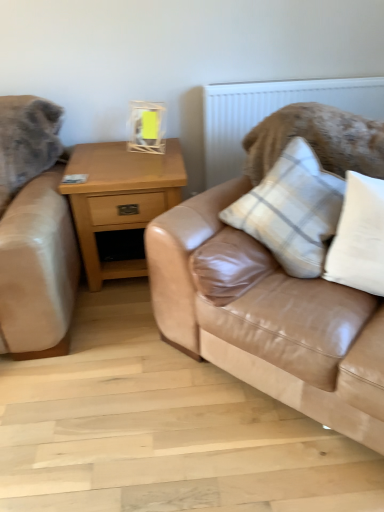
This screenshot has width=384, height=512. Find the location of `matte yellow glass at upper center`. matte yellow glass at upper center is located at coordinates (146, 127).

The width and height of the screenshot is (384, 512). Describe the element at coordinates (273, 112) in the screenshot. I see `white textured radiator at upper center` at that location.

Find the location of a particular element. Image resolution: width=384 pixels, height=512 pixels. white textured radiator at upper center is located at coordinates 273,112.

What do you see at coordinates (359, 237) in the screenshot?
I see `white cotton pillow at upper right, which is the 1th pillow from right to left` at bounding box center [359, 237].

I want to click on light brown wood nightstand at center, so click(x=120, y=198).

In order to face light brown wood nightstand at center, should I rotate leftwards or rightwards?

Turn left by 7.682 degrees to look at light brown wood nightstand at center.

Find the location of a particular element. The height and width of the screenshot is (512, 384). matte yellow glass at upper center is located at coordinates point(146,127).

From the image's perspective, does plaid fabric pillow at center, which is counted as the 1th pillow, starting from the left, appear higher than tan leather couch at center?

Indeed, from the image's perspective, plaid fabric pillow at center, which is counted as the 1th pillow, starting from the left, is shown above tan leather couch at center.

Is plaid fabric pillow at center, arranged as the second pillow when viewed from the right, positioned with its back to tan leather couch at center?

Yes, tan leather couch at center is at the back of plaid fabric pillow at center, arranged as the second pillow when viewed from the right.

What's the angular difference between plaid fabric pillow at center, which is counted as the 1th pillow, starting from the left, and tan leather couch at center's facing directions?

The angle between the facing direction of plaid fabric pillow at center, which is counted as the 1th pillow, starting from the left, and the facing direction of tan leather couch at center is 5.54 degrees.

Which pillow is the 2nd one when counting from the back of the tan leather couch at center? Please provide its 2D coordinates.

[(292, 210)]

Does tan leather couch at center appear on the right side of plaid fabric pillow at center, arranged as the second pillow when viewed from the right?

Correct, you'll find tan leather couch at center to the right of plaid fabric pillow at center, arranged as the second pillow when viewed from the right.

Does point (327, 297) lie in front of point (289, 144)?

That is True.

In the image, is tan leather couch at center positioned in front of or behind plaid fabric pillow at center, which is counted as the 1th pillow, starting from the left?

tan leather couch at center is positioned closer to the viewer than plaid fabric pillow at center, which is counted as the 1th pillow, starting from the left.

Does plaid fabric pillow at center, which is counted as the 1th pillow, starting from the left, turn towards light brown wood nightstand at center?

No, plaid fabric pillow at center, which is counted as the 1th pillow, starting from the left, is not aimed at light brown wood nightstand at center.

Who is smaller, plaid fabric pillow at center, which is counted as the 1th pillow, starting from the left, or light brown wood nightstand at center?

plaid fabric pillow at center, which is counted as the 1th pillow, starting from the left, is smaller.

Considering the points (336, 208) and (74, 220), which point is in front, point (336, 208) or point (74, 220)?

The point (336, 208) is more forward.

Considering the relative sizes of plaid fabric pillow at center, arranged as the second pillow when viewed from the right, and light brown wood nightstand at center in the image provided, is plaid fabric pillow at center, arranged as the second pillow when viewed from the right, thinner than light brown wood nightstand at center?

Yes.

Which is correct: matte yellow glass at upper center is inside white cotton pillow at upper right, arranged as the 2th pillow when viewed from the left, or outside of it?

matte yellow glass at upper center cannot be found inside white cotton pillow at upper right, arranged as the 2th pillow when viewed from the left.

Is matte yellow glass at upper center positioned before white cotton pillow at upper right, arranged as the 2th pillow when viewed from the left?

No, it is behind white cotton pillow at upper right, arranged as the 2th pillow when viewed from the left.

Looking at their sizes, would you say matte yellow glass at upper center is wider or thinner than white cotton pillow at upper right, arranged as the 2th pillow when viewed from the left?

matte yellow glass at upper center is thinner than white cotton pillow at upper right, arranged as the 2th pillow when viewed from the left.

Is matte yellow glass at upper center not close to white cotton pillow at upper right, which is the 1th pillow from right to left?

That's right, there is a large distance between matte yellow glass at upper center and white cotton pillow at upper right, which is the 1th pillow from right to left.

Which is in front, point (315, 177) or point (358, 207)?

The point (358, 207) is closer.

In terms of width, does plaid fabric pillow at center, arranged as the second pillow when viewed from the right, look wider or thinner when compared to white cotton pillow at upper right, arranged as the 2th pillow when viewed from the left?

Clearly, plaid fabric pillow at center, arranged as the second pillow when viewed from the right, has more width compared to white cotton pillow at upper right, arranged as the 2th pillow when viewed from the left.

Could you tell me if plaid fabric pillow at center, which is counted as the 1th pillow, starting from the left, is turned towards white cotton pillow at upper right, which is the 1th pillow from right to left?

No, plaid fabric pillow at center, which is counted as the 1th pillow, starting from the left, does not turn towards white cotton pillow at upper right, which is the 1th pillow from right to left.

Can you confirm if light brown wood nightstand at center is wider than plaid fabric pillow at center, arranged as the second pillow when viewed from the right?

Yes, light brown wood nightstand at center is wider than plaid fabric pillow at center, arranged as the second pillow when viewed from the right.

From a real-world perspective, is light brown wood nightstand at center beneath plaid fabric pillow at center, which is counted as the 1th pillow, starting from the left?

Correct, in the physical world, light brown wood nightstand at center is lower than plaid fabric pillow at center, which is counted as the 1th pillow, starting from the left.

Between light brown wood nightstand at center and plaid fabric pillow at center, which is counted as the 1th pillow, starting from the left, which one has larger size?

light brown wood nightstand at center is bigger.

From the image's perspective, does matte yellow glass at upper center appear lower than plaid fabric pillow at center, which is counted as the 1th pillow, starting from the left?

No, from the image's perspective, matte yellow glass at upper center is not beneath plaid fabric pillow at center, which is counted as the 1th pillow, starting from the left.

Does point (130, 128) come behind point (311, 250)?

Yes.

In the scene shown: Does matte yellow glass at upper center come in front of plaid fabric pillow at center, which is counted as the 1th pillow, starting from the left?

No, matte yellow glass at upper center is further to the viewer.

Find the location of `table lamp behind the plaid fabric pillow at center, arranged as the second pillow when viewed from the right`. table lamp behind the plaid fabric pillow at center, arranged as the second pillow when viewed from the right is located at coordinates (146, 127).

Image resolution: width=384 pixels, height=512 pixels. What are the coordinates of `studio couch in front of the plaid fabric pillow at center, arranged as the second pillow when viewed from the right` in the screenshot? It's located at (275, 286).

At what (x,y) coordinates should I click in order to perform the action: click on studio couch that is on the right side of plaid fabric pillow at center, which is counted as the 1th pillow, starting from the left. Please return your answer as a coordinate pair (x, y). The height and width of the screenshot is (512, 384). Looking at the image, I should click on (275, 286).

When comparing their distances from matte yellow glass at upper center, does white cotton pillow at upper right, arranged as the 2th pillow when viewed from the left, or plaid fabric pillow at center, which is counted as the 1th pillow, starting from the left, seem closer?

plaid fabric pillow at center, which is counted as the 1th pillow, starting from the left, is positioned closer to the anchor matte yellow glass at upper center.

When comparing their distances from light brown wood nightstand at center, does white textured radiator at upper center or tan leather couch at center seem further?

tan leather couch at center lies further to light brown wood nightstand at center than the other object.

Which object lies nearer to the anchor point matte yellow glass at upper center, tan leather couch at center or white textured radiator at upper center?

Based on the image, white textured radiator at upper center appears to be nearer to matte yellow glass at upper center.

Estimate the real-world distances between objects in this image. Which object is further from plaid fabric pillow at center, which is counted as the 1th pillow, starting from the left, light brown wood nightstand at center or tan leather couch at center?

light brown wood nightstand at center is positioned further to the anchor plaid fabric pillow at center, which is counted as the 1th pillow, starting from the left.

Based on their spatial positions, is white cotton pillow at upper right, arranged as the 2th pillow when viewed from the left, or matte yellow glass at upper center closer to light brown wood nightstand at center?

matte yellow glass at upper center.

Looking at the image, which one is located further to white cotton pillow at upper right, arranged as the 2th pillow when viewed from the left, light brown wood nightstand at center or plaid fabric pillow at center, which is counted as the 1th pillow, starting from the left?

light brown wood nightstand at center lies further to white cotton pillow at upper right, arranged as the 2th pillow when viewed from the left, than the other object.

Which object lies nearer to the anchor point matte yellow glass at upper center, plaid fabric pillow at center, which is counted as the 1th pillow, starting from the left, or tan leather couch at center?

plaid fabric pillow at center, which is counted as the 1th pillow, starting from the left, is closer to matte yellow glass at upper center.

Considering their positions, is white textured radiator at upper center positioned closer to plaid fabric pillow at center, which is counted as the 1th pillow, starting from the left, than light brown wood nightstand at center?

Based on the image, light brown wood nightstand at center appears to be nearer to plaid fabric pillow at center, which is counted as the 1th pillow, starting from the left.

Where is `pillow located between tan leather couch at center and plaid fabric pillow at center, arranged as the second pillow when viewed from the right, in the depth direction`? The width and height of the screenshot is (384, 512). pillow located between tan leather couch at center and plaid fabric pillow at center, arranged as the second pillow when viewed from the right, in the depth direction is located at coordinates tap(359, 237).

Where is `radiator located between light brown wood nightstand at center and white cotton pillow at upper right, arranged as the 2th pillow when viewed from the left, in the left-right direction`? This screenshot has height=512, width=384. radiator located between light brown wood nightstand at center and white cotton pillow at upper right, arranged as the 2th pillow when viewed from the left, in the left-right direction is located at coordinates (273, 112).

Find the location of a particular element. The image size is (384, 512). nightstand between plaid fabric pillow at center, which is counted as the 1th pillow, starting from the left, and matte yellow glass at upper center in the front-back direction is located at coordinates pyautogui.click(x=120, y=198).

At what (x,y) coordinates should I click in order to perform the action: click on pillow between white cotton pillow at upper right, which is the 1th pillow from right to left, and white textured radiator at upper center, along the z-axis. Please return your answer as a coordinate pair (x, y). Image resolution: width=384 pixels, height=512 pixels. Looking at the image, I should click on (292, 210).